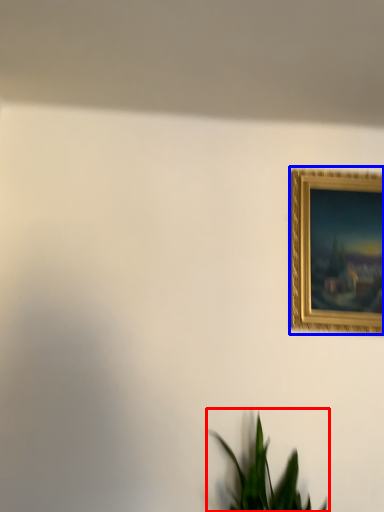
Question: Which point is closer to the camera, houseplant (highlighted by a red box) or picture frame (highlighted by a blue box)?

Choices:
 (A) houseplant
 (B) picture frame

Answer: (A)